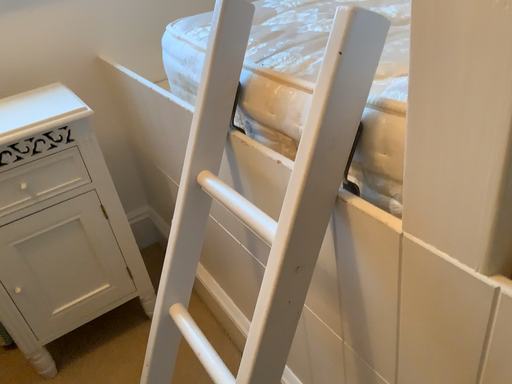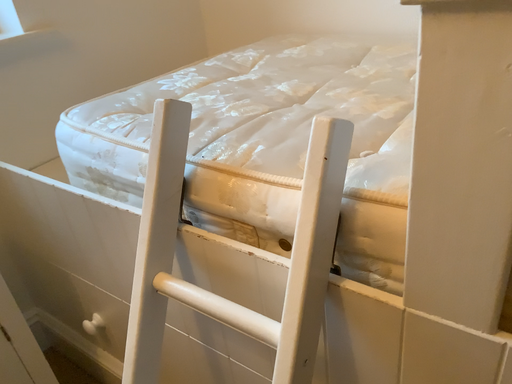
Question: Which way did the camera rotate in the video?

Choices:
 (A) rotated left
 (B) rotated right

Answer: (B)